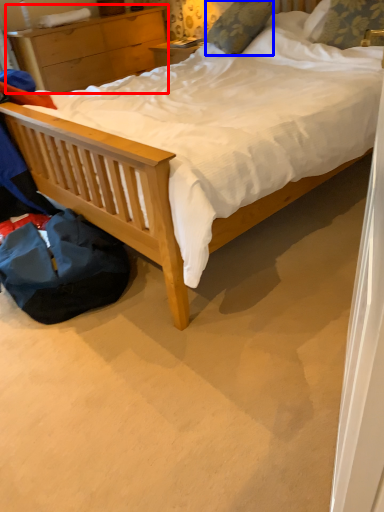
Question: Which of the following is the farthest to the observer, nightstand (highlighted by a red box) or pillow (highlighted by a blue box)?

Choices:
 (A) nightstand
 (B) pillow

Answer: (A)